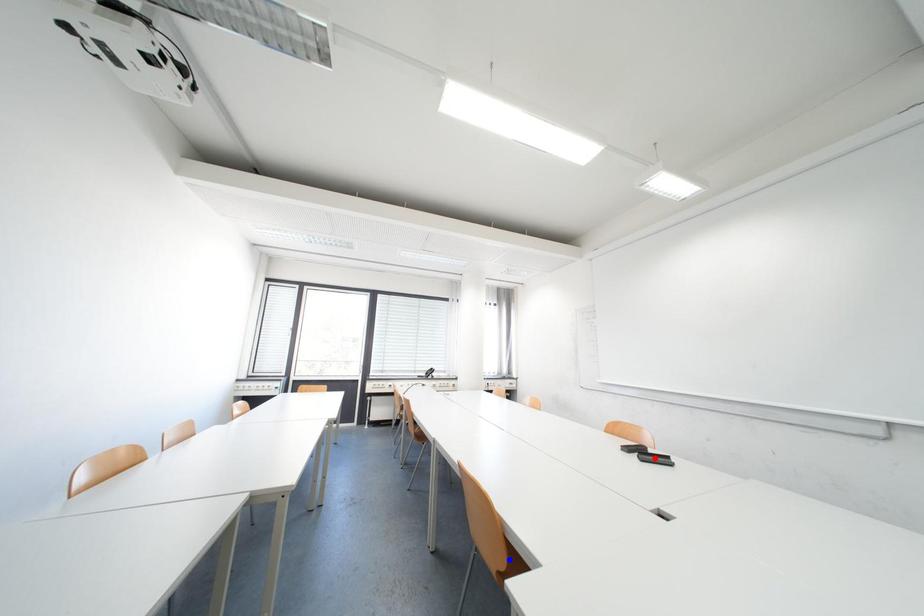
Question: In the image, two points are highlighted. Which point is nearer to the camera? Reply with the corresponding letter.

Choices:
 (A) blue point
 (B) red point

Answer: (A)